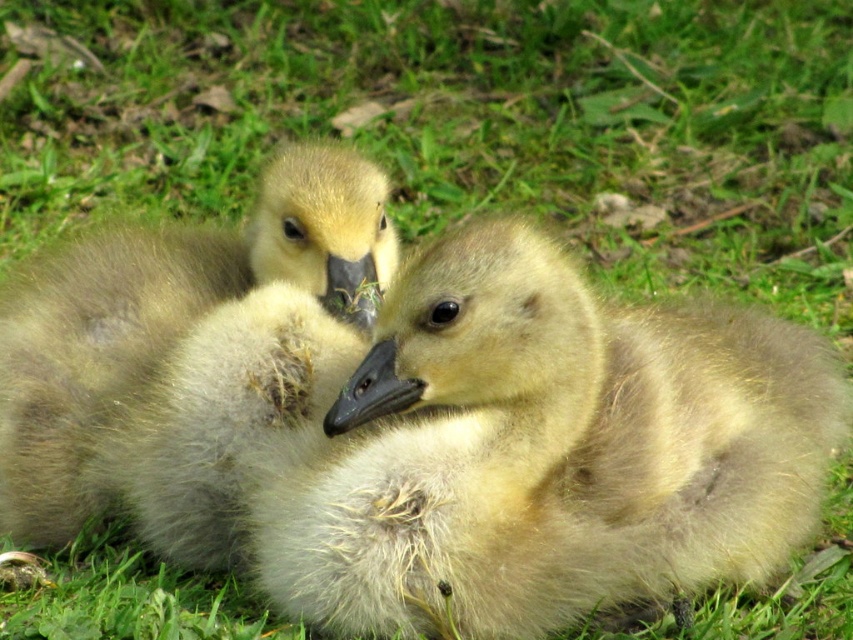
Does soft yellow down at center lie in front of soft brown downy goose at left?

Yes.

Can you confirm if soft yellow down at center is wider than soft brown downy goose at left?

Yes, soft yellow down at center is wider than soft brown downy goose at left.

Between point (787, 406) and point (283, 332), which one is positioned in front?

Point (283, 332)

I want to click on soft yellow down at center, so click(546, 451).